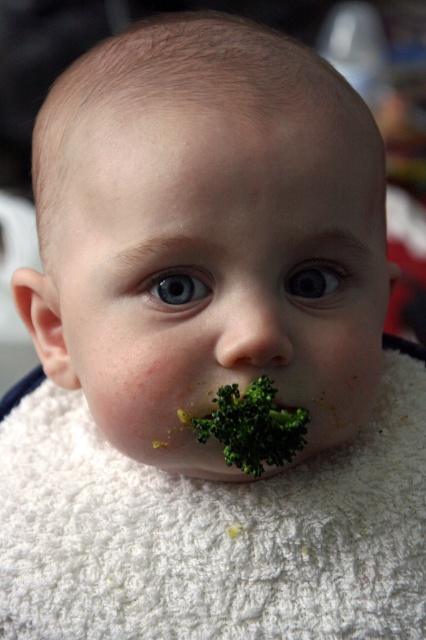
The baby has a green textured broccoli at mouth and a blue glossy eye at center. Which object is located lower in the image?

The green textured broccoli at mouth is located below the blue glossy eye at center, so the broccoli is lower.

You are a photographer adjusting the focus on your camera. You need to ensure that both the green matte broccoli at center and the blue glossy eye at center are in focus. Given their sizes, which object should you adjust the focus for first to ensure both are sharp?

The green matte broccoli at center has a larger width than the blue glossy eye at center. Since the broccoli is larger, you should focus on it first to ensure both objects remain in sharp focus.

You are a photographer who wants to adjust the lighting to focus on the baby while ensuring the blue glossy eye at center and white fluffy blanket at center are both visible. Given their positions, which object should you adjust the light to highlight first?

The blue glossy eye at center is behind the white fluffy blanket at center, so you should adjust the light to highlight the white fluffy blanket at center first to ensure both objects are visible.